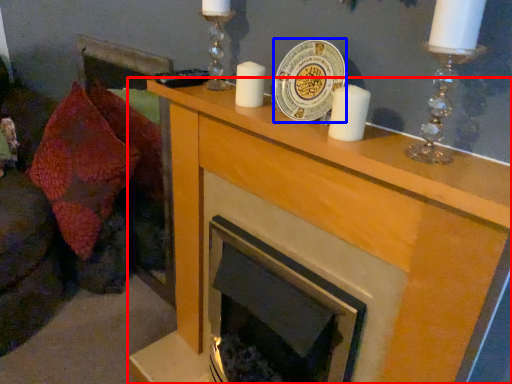
Question: Among these objects, which one is nearest to the camera, cabinetry (highlighted by a red box) or platter (highlighted by a blue box)?

Choices:
 (A) cabinetry
 (B) platter

Answer: (A)